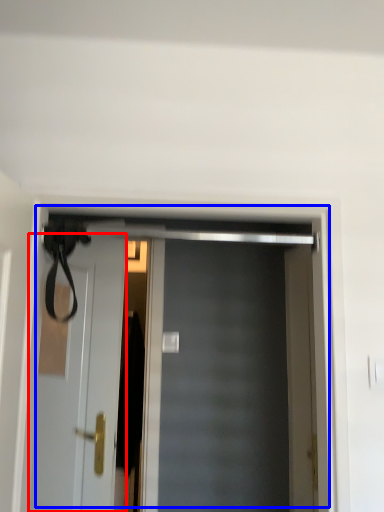
Question: Which object is closer to the camera taking this photo, door (highlighted by a red box) or door (highlighted by a blue box)?

Choices:
 (A) door
 (B) door

Answer: (B)